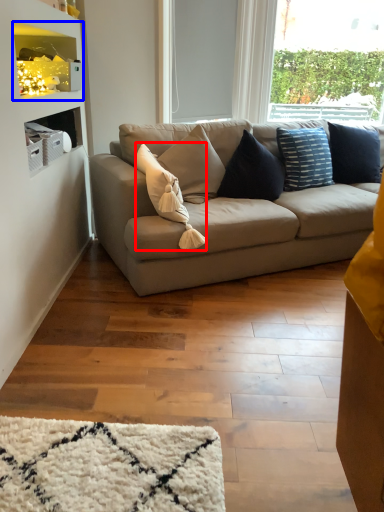
Question: Which object appears closest to the camera in this image, pillow (highlighted by a red box) or shelf (highlighted by a blue box)?

Choices:
 (A) pillow
 (B) shelf

Answer: (A)